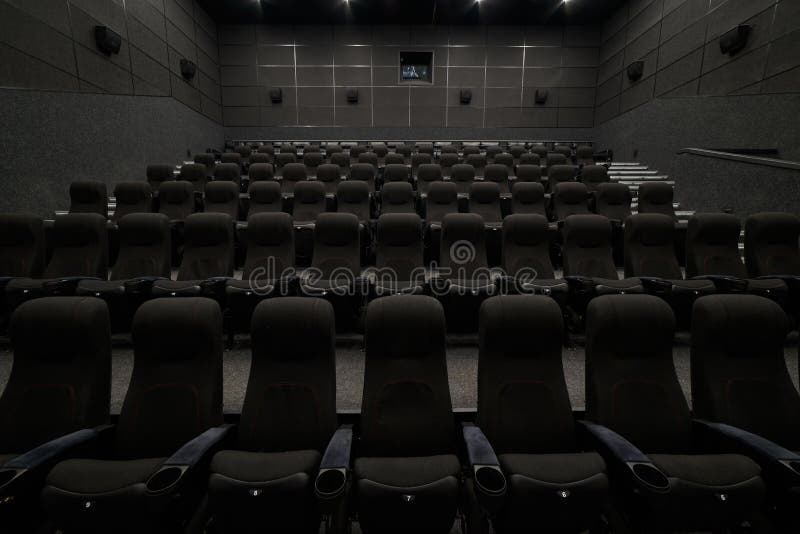
Find the location of a particular element. speaker is located at coordinates (733, 40), (632, 70), (541, 96), (464, 95), (352, 98), (274, 97), (188, 69), (109, 40).